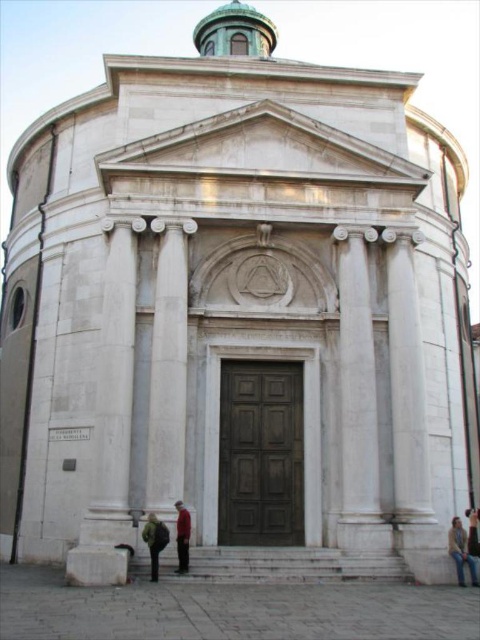
In the scene shown: Can you confirm if white marble stairs at center is positioned to the left of red fabric coat at lower center?

No, white marble stairs at center is not to the left of red fabric coat at lower center.

Does white marble stairs at center have a greater height compared to red fabric coat at lower center?

No.

The image size is (480, 640). I want to click on white marble stairs at center, so click(291, 564).

Does point (460, 541) lie in front of point (151, 541)?

No, (460, 541) is further to viewer.

Does light brown leather jacket at lower right have a smaller size compared to green fuzzy coat at lower center?

Incorrect, light brown leather jacket at lower right is not smaller in size than green fuzzy coat at lower center.

Is point (474, 573) positioned before point (168, 532)?

No, it is not.

I want to click on light brown leather jacket at lower right, so click(x=460, y=552).

What do you see at coordinates (358, 400) in the screenshot? The image size is (480, 640). I see `white marble column at center` at bounding box center [358, 400].

Is point (344, 307) closer to camera compared to point (457, 573)?

No, it is not.

Locate an element on the screen. This screenshot has height=640, width=480. white marble column at center is located at coordinates (358, 400).